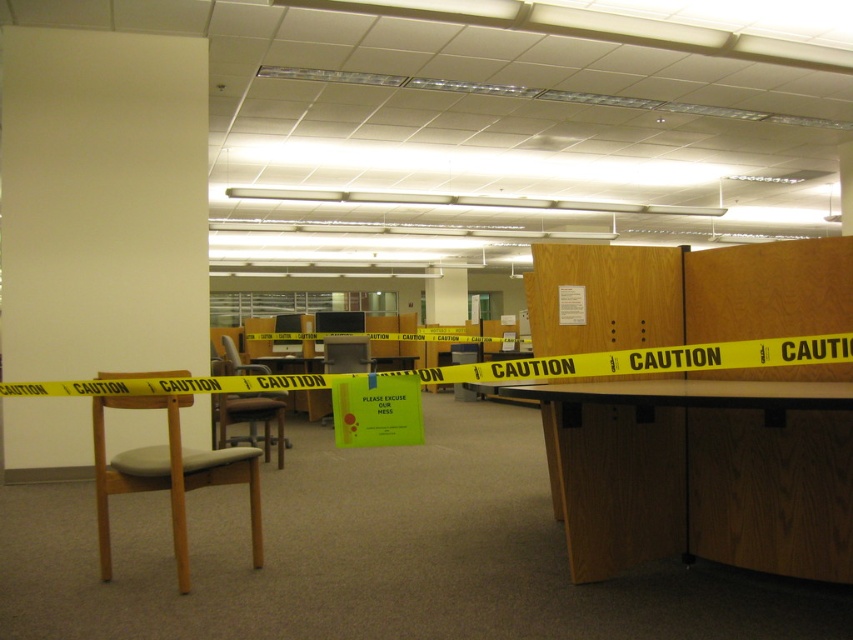
What is located at the point with coordinates (701, 474)?

The wooden table at lower right is located at the point with coordinates (701, 474).

You are an office worker who needs to move a box from the desk to the storage area. You see the light brown wood swivel chair at left and the wooden chair at left. Which chair has a narrower seat to avoid hitting the box while moving?

The light brown wood swivel chair at left has a lesser width compared to wooden chair at left, so it has a narrower seat and would be better to avoid hitting the box while moving.

You are standing at the entrance of the office and see the light brown wood swivel chair at left. If you want to move to the chair, in which direction should you walk?

To reach the light brown wood swivel chair at left, you should walk towards the left side of the office since the chair is positioned at point [167,476], which is on the left side relative to your starting position at the entrance.